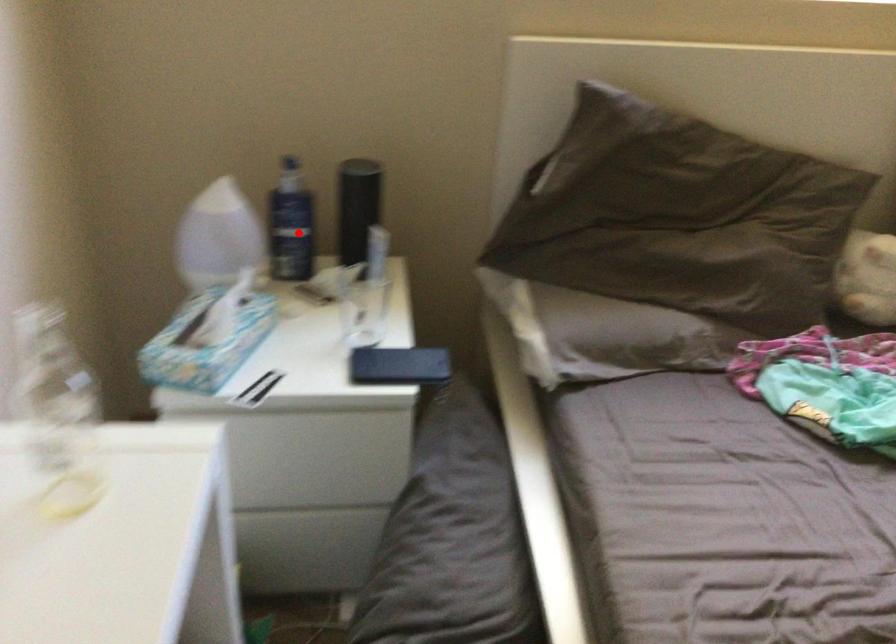
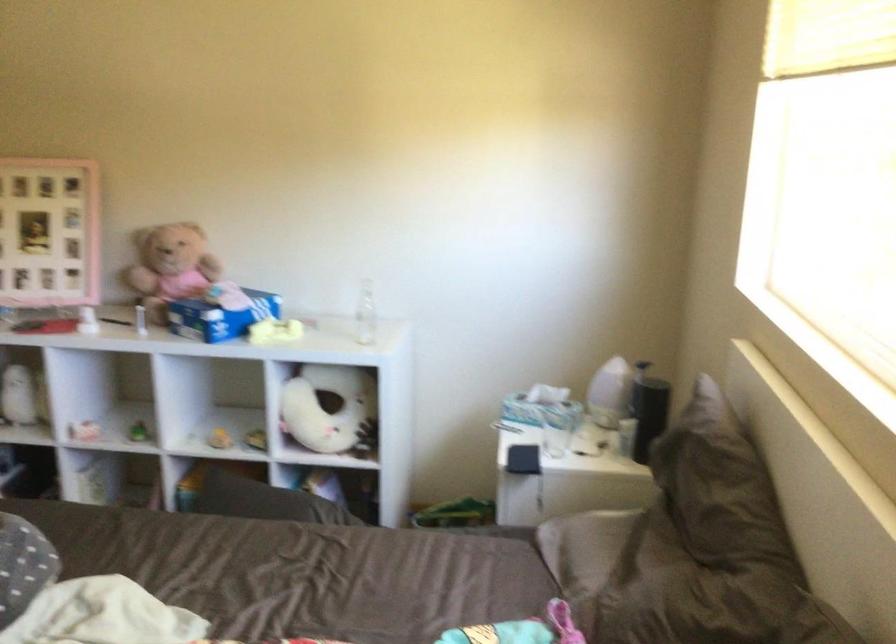
Locate, in the second image, the point that corresponds to the highlighted location in the first image.

(613, 393)